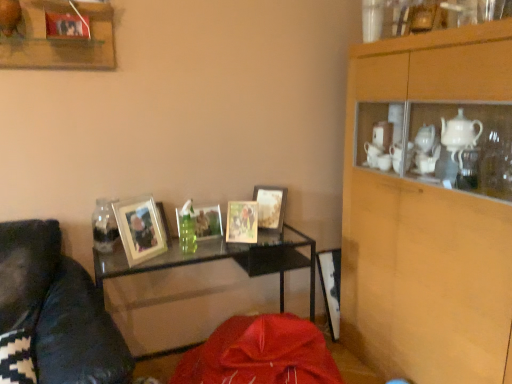
Consider the image. What is the approximate height of matte wooden picture frame at center, which is the 3th picture frame from left to right?

matte wooden picture frame at center, which is the 3th picture frame from left to right, is 8.47 inches tall.

In order to click on metallic silver picture frame at center, the 3th picture frame from the right in this screenshot , I will do `click(207, 222)`.

This screenshot has width=512, height=384. Describe the element at coordinates (207, 222) in the screenshot. I see `metallic silver picture frame at center, the 3th picture frame from the right` at that location.

Image resolution: width=512 pixels, height=384 pixels. What do you see at coordinates (223, 258) in the screenshot? I see `clear glass table at center` at bounding box center [223, 258].

Describe the element at coordinates (104, 226) in the screenshot. I see `clear glass jar at left` at that location.

The height and width of the screenshot is (384, 512). Identify the location of clear glass jar at left. point(104,226).

What do you see at coordinates (60, 38) in the screenshot? I see `wooden frame at upper left` at bounding box center [60, 38].

Measure the distance between wooden photo frame at center, placed as the first picture frame when sorted from right to left, and camera.

wooden photo frame at center, placed as the first picture frame when sorted from right to left, is 7.05 feet from camera.

Locate an element on the screen. matte silver picture frame at center-left, acting as the fourth picture frame starting from the right is located at coordinates (140, 228).

Considering the relative sizes of clear glass table at center and matte wooden picture frame at center, which ranks as the 2th picture frame in right-to-left order, in the image provided, is clear glass table at center smaller than matte wooden picture frame at center, which ranks as the 2th picture frame in right-to-left order,?

Actually, clear glass table at center might be larger than matte wooden picture frame at center, which ranks as the 2th picture frame in right-to-left order.

Is clear glass table at center touching matte wooden picture frame at center, which ranks as the 2th picture frame in right-to-left order?

No, clear glass table at center is not making contact with matte wooden picture frame at center, which ranks as the 2th picture frame in right-to-left order.

Is clear glass table at center wider or thinner than matte wooden picture frame at center, which ranks as the 2th picture frame in right-to-left order?

clear glass table at center is wider than matte wooden picture frame at center, which ranks as the 2th picture frame in right-to-left order.

The width and height of the screenshot is (512, 384). What are the coordinates of `desk in front of the matte wooden picture frame at center, which ranks as the 2th picture frame in right-to-left order` in the screenshot? It's located at (223, 258).

From the picture: Measure the distance from matte silver picture frame at center-left, placed as the 1th picture frame when sorted from left to right, to matte wooden picture frame at center, which ranks as the 2th picture frame in right-to-left order.

41.28 centimeters.

Where is `the 2nd picture frame to the right when counting from the matte silver picture frame at center-left, placed as the 1th picture frame when sorted from left to right`? the 2nd picture frame to the right when counting from the matte silver picture frame at center-left, placed as the 1th picture frame when sorted from left to right is located at coordinates (242, 222).

From the image's perspective, is matte silver picture frame at center-left, acting as the fourth picture frame starting from the right, below matte wooden picture frame at center, which ranks as the 2th picture frame in right-to-left order?

Indeed, from the image's perspective, matte silver picture frame at center-left, acting as the fourth picture frame starting from the right, is shown beneath matte wooden picture frame at center, which ranks as the 2th picture frame in right-to-left order.

Which of these two, matte silver picture frame at center-left, placed as the 1th picture frame when sorted from left to right, or matte wooden picture frame at center, which ranks as the 2th picture frame in right-to-left order, is bigger?

matte silver picture frame at center-left, placed as the 1th picture frame when sorted from left to right.

From a real-world perspective, is clear glass jar at left positioned under clear glass table at center based on gravity?

No, from a real-world perspective, clear glass jar at left is not beneath clear glass table at center.

Is the surface of clear glass jar at left in direct contact with clear glass table at center?

No, clear glass jar at left is not in contact with clear glass table at center.

Between clear glass jar at left and clear glass table at center, which one has more height?

clear glass table at center is taller.

From the image's perspective, who appears lower, matte wooden picture frame at center, which ranks as the 2th picture frame in right-to-left order, or wooden frame at upper left?

matte wooden picture frame at center, which ranks as the 2th picture frame in right-to-left order, from the image's perspective.

Between matte wooden picture frame at center, which ranks as the 2th picture frame in right-to-left order, and wooden frame at upper left, which one has larger size?

With larger size is wooden frame at upper left.

Looking at this image, from a real-world perspective, is matte wooden picture frame at center, which is the 3th picture frame from left to right, on top of wooden frame at upper left?

Actually, matte wooden picture frame at center, which is the 3th picture frame from left to right, is physically below wooden frame at upper left in the real world.

Is matte wooden picture frame at center, which ranks as the 2th picture frame in right-to-left order, positioned far away from wooden frame at upper left?

Indeed, matte wooden picture frame at center, which ranks as the 2th picture frame in right-to-left order, is not near wooden frame at upper left.

Can you tell me how much metallic silver picture frame at center, acting as the 2th picture frame starting from the left, and clear glass table at center differ in facing direction?

There is a 4.91-degree angle between the facing directions of metallic silver picture frame at center, acting as the 2th picture frame starting from the left, and clear glass table at center.

From the image's perspective, which is above, metallic silver picture frame at center, the 3th picture frame from the right, or clear glass table at center?

metallic silver picture frame at center, the 3th picture frame from the right, is shown above in the image.

Is metallic silver picture frame at center, the 3th picture frame from the right, completely or partially outside of clear glass table at center?

Absolutely, metallic silver picture frame at center, the 3th picture frame from the right, is external to clear glass table at center.

Is metallic silver picture frame at center, acting as the 2th picture frame starting from the left, turned away from clear glass table at center?

No, metallic silver picture frame at center, acting as the 2th picture frame starting from the left,'s orientation is not away from clear glass table at center.

Can you confirm if metallic silver picture frame at center, the 3th picture frame from the right, is positioned to the right of wooden photo frame at center, positioned as the 4th picture frame in left-to-right order?

No, metallic silver picture frame at center, the 3th picture frame from the right, is not to the right of wooden photo frame at center, positioned as the 4th picture frame in left-to-right order.

In the scene shown: Which point is more forward, (210,233) or (272,207)?

The point (210,233) is in front.

Is wooden photo frame at center, placed as the first picture frame when sorted from right to left, surrounded by metallic silver picture frame at center, acting as the 2th picture frame starting from the left?

No, metallic silver picture frame at center, acting as the 2th picture frame starting from the left, does not contain wooden photo frame at center, placed as the first picture frame when sorted from right to left.

Considering the sizes of objects metallic silver picture frame at center, acting as the 2th picture frame starting from the left, and wooden photo frame at center, positioned as the 4th picture frame in left-to-right order, in the image provided, who is shorter, metallic silver picture frame at center, acting as the 2th picture frame starting from the left, or wooden photo frame at center, positioned as the 4th picture frame in left-to-right order,?

With less height is metallic silver picture frame at center, acting as the 2th picture frame starting from the left.

Is the position of wooden photo frame at center, positioned as the 4th picture frame in left-to-right order, more distant than that of wooden frame at upper left?

Yes, the depth of wooden photo frame at center, positioned as the 4th picture frame in left-to-right order, is greater than that of wooden frame at upper left.

From the image's perspective, is wooden photo frame at center, positioned as the 4th picture frame in left-to-right order, on top of wooden frame at upper left?

Incorrect, from the image's perspective, wooden photo frame at center, positioned as the 4th picture frame in left-to-right order, is lower than wooden frame at upper left.

What's the angular difference between wooden photo frame at center, positioned as the 4th picture frame in left-to-right order, and wooden frame at upper left's facing directions?

They differ by 38.1 degrees in their facing directions.

Is wooden photo frame at center, placed as the first picture frame when sorted from right to left, beside wooden frame at upper left?

No, wooden photo frame at center, placed as the first picture frame when sorted from right to left, is not in contact with wooden frame at upper left.

Locate an element on the screen. The height and width of the screenshot is (384, 512). desk below the matte wooden picture frame at center, which ranks as the 2th picture frame in right-to-left order (from a real-world perspective) is located at coordinates (223, 258).

Locate an element on the screen. This screenshot has height=384, width=512. the 2nd picture frame to the left of the matte wooden picture frame at center, which ranks as the 2th picture frame in right-to-left order, starting your count from the anchor is located at coordinates (140, 228).

Which object lies nearer to the anchor point matte silver picture frame at center-left, placed as the 1th picture frame when sorted from left to right, wooden cabinet at upper right or clear glass jar at left?

clear glass jar at left is closer to matte silver picture frame at center-left, placed as the 1th picture frame when sorted from left to right.

Considering their positions, is clear glass table at center positioned closer to wooden cabinet at upper right than wooden frame at upper left?

clear glass table at center.

Estimate the real-world distances between objects in this image. Which object is further from clear glass table at center, wooden cabinet at upper right or clear glass jar at left?

wooden cabinet at upper right is further to clear glass table at center.

When comparing their distances from clear glass jar at left, does wooden photo frame at center, positioned as the 4th picture frame in left-to-right order, or matte silver picture frame at center-left, acting as the fourth picture frame starting from the right, seem further?

wooden photo frame at center, positioned as the 4th picture frame in left-to-right order, lies further to clear glass jar at left than the other object.

Based on the photo, based on their spatial positions, is matte silver picture frame at center-left, placed as the 1th picture frame when sorted from left to right, or wooden cabinet at upper right closer to clear glass table at center?

matte silver picture frame at center-left, placed as the 1th picture frame when sorted from left to right, lies closer to clear glass table at center than the other object.

From the image, which object appears to be nearer to wooden photo frame at center, positioned as the 4th picture frame in left-to-right order, matte wooden picture frame at center, which ranks as the 2th picture frame in right-to-left order, or metallic silver picture frame at center, acting as the 2th picture frame starting from the left?

Among the two, matte wooden picture frame at center, which ranks as the 2th picture frame in right-to-left order, is located nearer to wooden photo frame at center, positioned as the 4th picture frame in left-to-right order.

Based on their spatial positions, is clear glass table at center or wooden photo frame at center, placed as the first picture frame when sorted from right to left, closer to clear glass jar at left?

clear glass table at center.

Considering their positions, is clear glass table at center positioned further to wooden photo frame at center, positioned as the 4th picture frame in left-to-right order, than wooden frame at upper left?

Based on the image, wooden frame at upper left appears to be further to wooden photo frame at center, positioned as the 4th picture frame in left-to-right order.

Where is `picture frame between wooden frame at upper left and metallic silver picture frame at center, acting as the 2th picture frame starting from the left, from top to bottom`? This screenshot has height=384, width=512. picture frame between wooden frame at upper left and metallic silver picture frame at center, acting as the 2th picture frame starting from the left, from top to bottom is located at coordinates (270, 207).

Image resolution: width=512 pixels, height=384 pixels. In order to click on glass vase between wooden frame at upper left and wooden cabinet at upper right in the horizontal direction in this screenshot , I will do `click(104, 226)`.

Image resolution: width=512 pixels, height=384 pixels. I want to click on picture frame between metallic silver picture frame at center, the 3th picture frame from the right, and wooden photo frame at center, positioned as the 4th picture frame in left-to-right order, so click(242, 222).

Where is `desk between clear glass jar at left and matte wooden picture frame at center, which ranks as the 2th picture frame in right-to-left order`? This screenshot has width=512, height=384. desk between clear glass jar at left and matte wooden picture frame at center, which ranks as the 2th picture frame in right-to-left order is located at coordinates (223, 258).